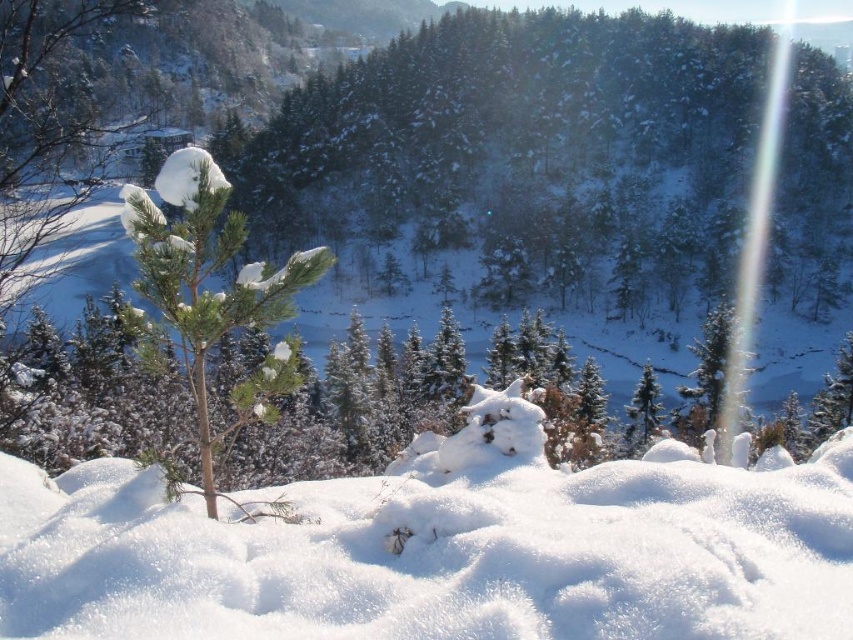
Question: Is white fluffy snow at center further to the viewer compared to green matte pine tree at left?

Choices:
 (A) no
 (B) yes

Answer: (A)

Question: Can you confirm if white fluffy snow at center is positioned to the right of green matte tree at upper right?

Choices:
 (A) no
 (B) yes

Answer: (A)

Question: In this image, where is green matte pine tree at left located relative to green matte tree at upper right?

Choices:
 (A) right
 (B) left

Answer: (B)

Question: Which point appears farthest from the camera in this image?

Choices:
 (A) (723, 374)
 (B) (207, 186)
 (C) (726, 467)
 (D) (650, 378)

Answer: (D)

Question: Which point is closer to the camera taking this photo?

Choices:
 (A) (157, 220)
 (B) (172, 557)
 (C) (625, 442)

Answer: (B)

Question: Which object is positioned farthest from the white fluffy snow at center?

Choices:
 (A) green matte tree at center-right
 (B) green matte pine tree at left
 (C) green matte tree at upper right

Answer: (C)